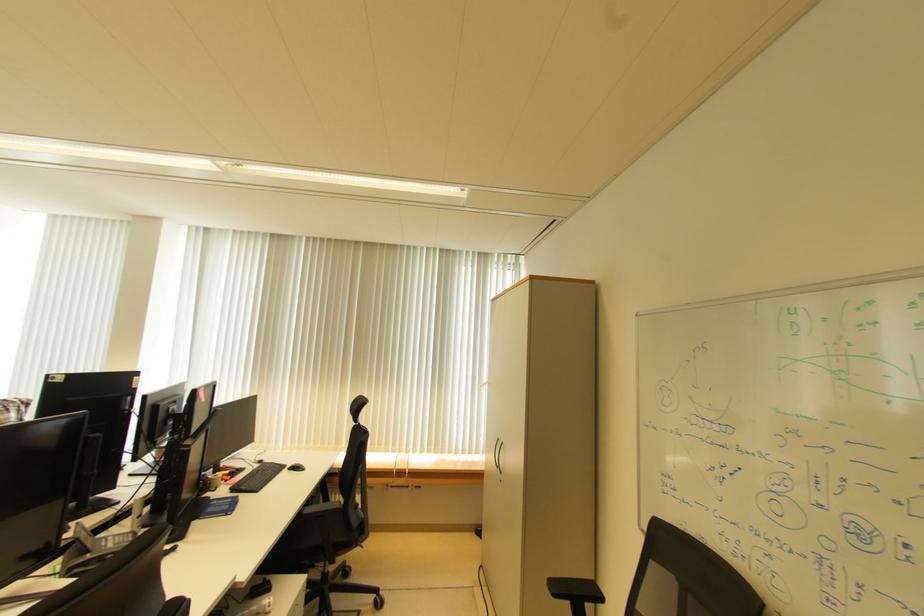
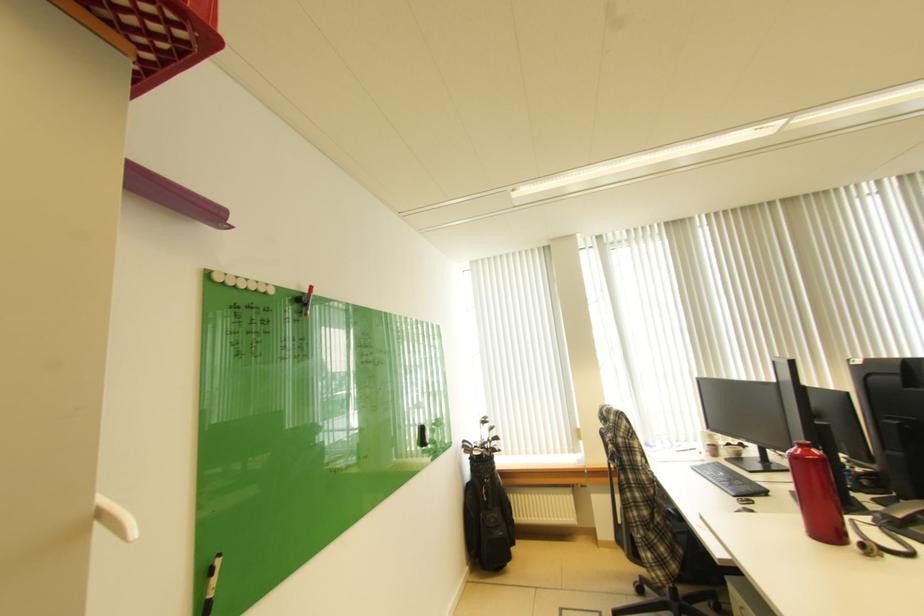
Question: What movement of the cameraman would produce the second image?

Choices:
 (A) Left
 (B) Right
 (C) Forward
 (D) Backward

Answer: (A)